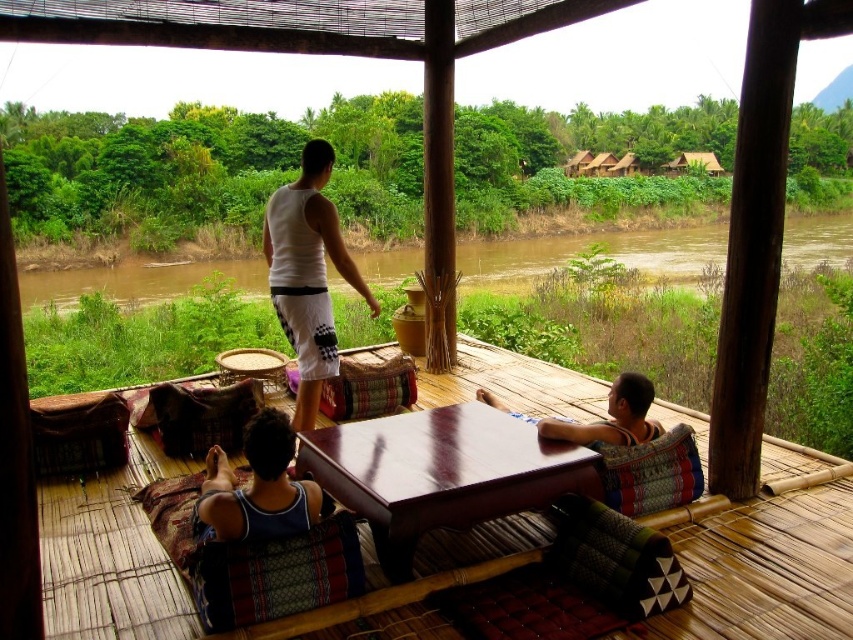
Question: Can you confirm if white matte tank top at center is bigger than matte brown fabric at right?

Choices:
 (A) no
 (B) yes

Answer: (A)

Question: Among these points, which one is farthest from the camera?

Choices:
 (A) (376, 611)
 (B) (321, 198)

Answer: (B)

Question: Does mahogany wood table at center have a larger size compared to matte brown fabric at right?

Choices:
 (A) no
 (B) yes

Answer: (B)

Question: Where is brown muddy water at center located in relation to white matte tank top at center in the image?

Choices:
 (A) left
 (B) right

Answer: (B)

Question: Which object appears farthest from the camera in this image?

Choices:
 (A) mahogany wood table at center
 (B) wooden table at center
 (C) white matte tank top at center

Answer: (C)

Question: Which object is positioned farthest from the mahogany wood table at center?

Choices:
 (A) white matte tank top at center
 (B) wooden table at center

Answer: (B)